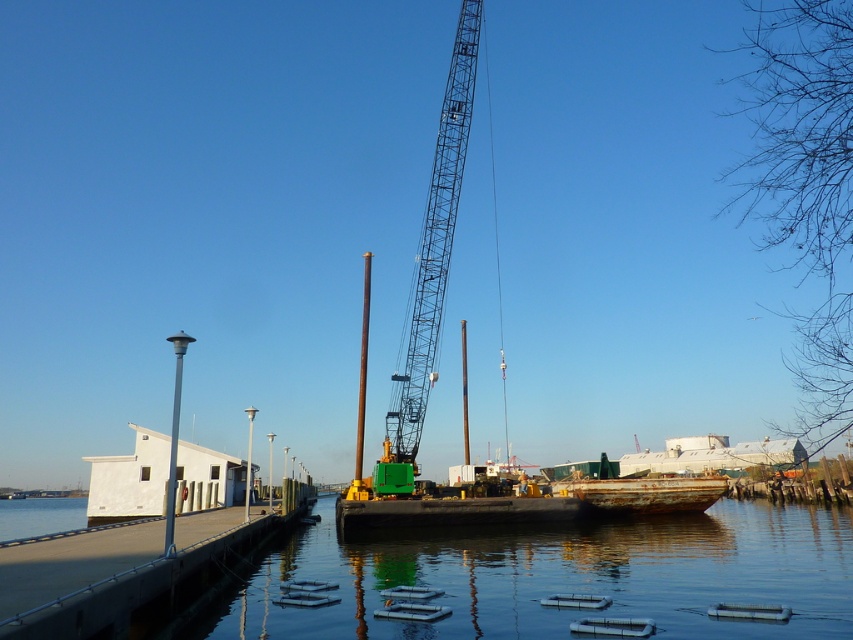
You are standing on the concrete dock at lower left and want to reach the metallic blue crane at center. Which direction should you move to get closer to the crane?

Since the concrete dock at lower left is below the metallic blue crane at center, you should move upward to reach the crane.

You are a boat operator trying to navigate a new vessel through the dock area. The vessel requires a minimum width of 10 meters to pass safely. Based on the scene, can you determine if the clear water at dock center has enough width to accommodate your vessel compared to the rusty metal boat at lower right?

The clear water at dock center might be wider than the rusty metal boat at lower right, so there is a possibility that the water area is wide enough for the vessel. However, since the exact width isn not provided, it is recommended to measure or confirm with local authorities before proceeding.

From the picture: You are standing at the edge of the pier and want to take a photo of both the crane and the lamppost. The crane is located at point (111,560) and the lamppost is at point (412,403). Which object should you focus on first to ensure both are in clear view?

You should focus on the crane at point (111,560) first because it is closer to the camera than the lamppost at point (412,403). This ensures both objects remain in focus as the depth of field will cover the distance between them.